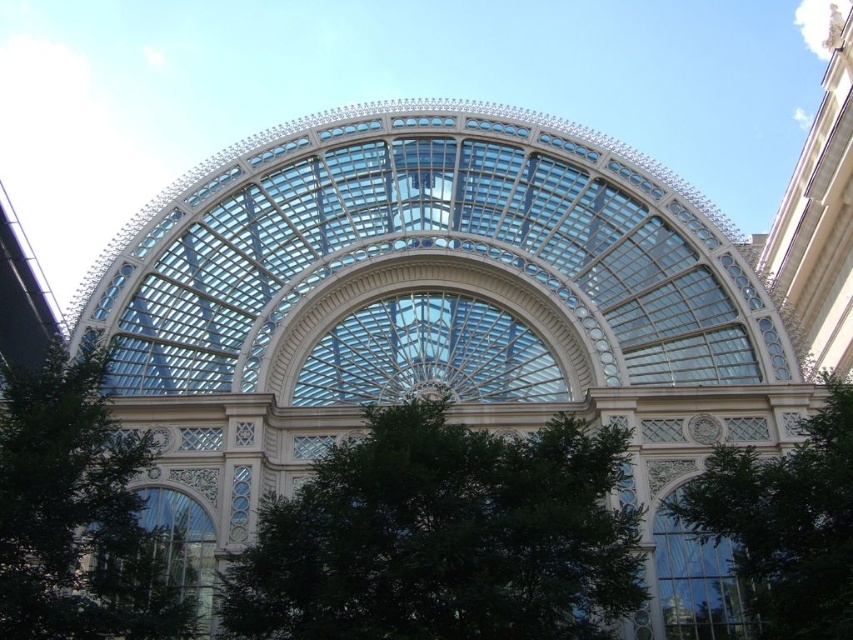
You are a landscape architect planning to install a new walkway between the green leafy tree at lower left and the green leafy tree at lower right. The walkway needs to be 35 meters long to accommodate visitors comfortably. Based on the scene, will the walkway fit between the two trees?

The distance between the green leafy tree at lower left and the green leafy tree at lower right is 36.65 meters, which is longer than the required 35 meters for the walkway. Therefore, the walkway will fit comfortably between the two trees with some extra space remaining.

You are standing at the center of the grand architectural structure with the arched glass roof. You want to exit through the main entrance which is located at point 0.5 on the x and y axis. The green leafy tree at lower left is at point 0.803, 0.094. Which direction should you walk to reach the entrance?

You should walk towards the center from the green leafy tree at lower left since the entrance is at point (426, 320), while the tree is located at (79, 513). Moving towards the center would lead you to the entrance.